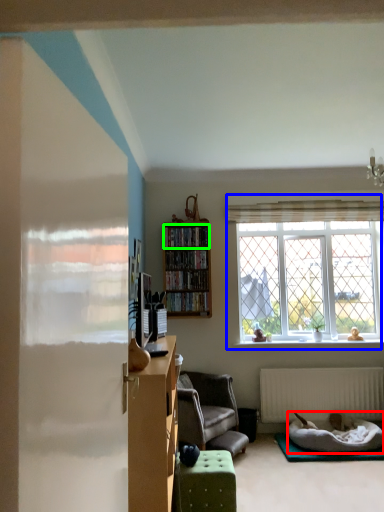
Question: Which object is positioned closest to bedding (highlighted by a red box)? Select from window (highlighted by a blue box) and cabinet (highlighted by a green box).

Choices:
 (A) window
 (B) cabinet

Answer: (A)